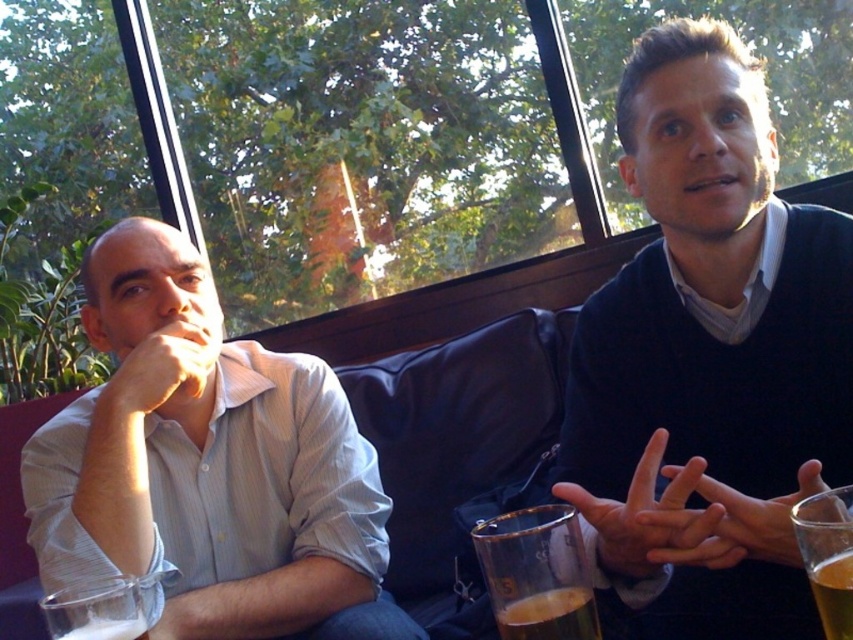
You are standing in the room and want to reach both the point at coordinates point (x=120, y=611) and the point at coordinates point (x=505, y=604). Which point will you reach first?

You will reach point (x=120, y=611) first because it is closer to you than point (x=505, y=604), which is further away.

You are a photographer standing at the entrance of the cafe. You want to take a photo that includes both the point at (577, 547) and the point at (65, 625). Which point should you position closer to the camera to ensure both are in focus?

To ensure both points are in focus, position the point at (65, 625) closer to the camera since it is behind the point at (577, 547). This way, the depth of field will cover both points effectively.

You are a bartender who needs to serve two beers. The clear glass beer at lower left and the translucent glass beer at lower center are on the same table. Which beer is closer to the edge of the table?

The clear glass beer at lower left is closer to the edge of the table because it is positioned under the translucent glass beer at lower center, indicating it is lower in elevation and possibly nearer the edge.